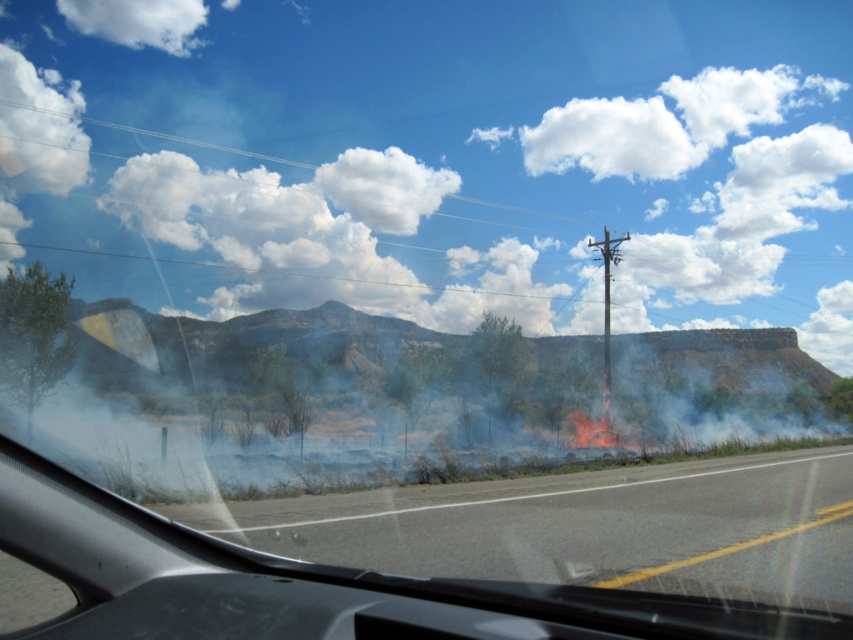
Is smooth asphalt highway at center in front of metallic gray telegraph pole at right?

Yes, it is.

Can you confirm if smooth asphalt highway at center is taller than metallic gray telegraph pole at right?

No, smooth asphalt highway at center is not taller than metallic gray telegraph pole at right.

Who is more forward, [524,525] or [607,305]?

Positioned in front is point [524,525].

You are a GUI agent. You are given a task and a screenshot of the screen. Output one action in this format:
    pyautogui.click(x=<x>, y=<y>)
    Task: Click on the smooth asphalt highway at center
    Image resolution: width=853 pixels, height=640 pixels.
    Given the screenshot: What is the action you would take?
    pyautogui.click(x=589, y=528)